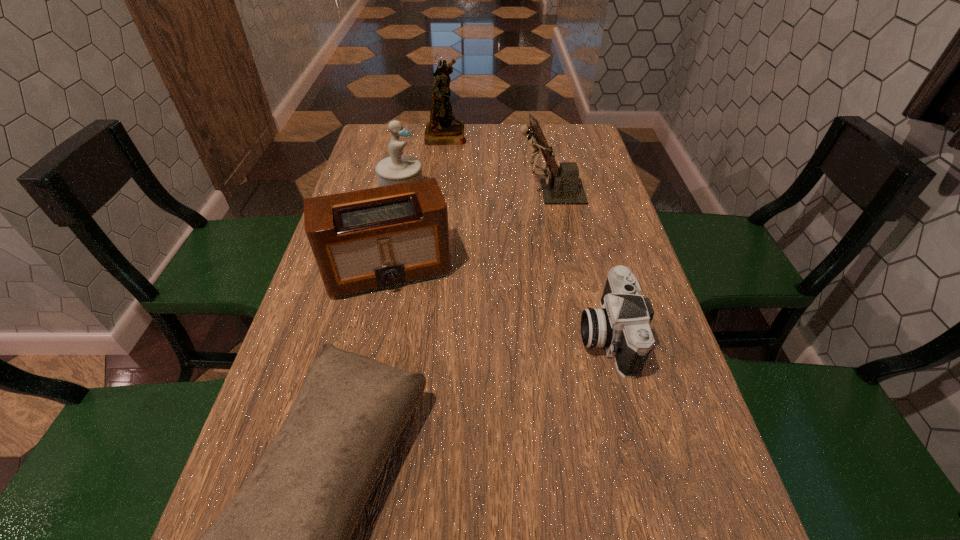
This screenshot has height=540, width=960. I want to click on object located at the far edge, so click(443, 129).

Locate an element on the screen. This screenshot has height=540, width=960. figurine at the left edge is located at coordinates (398, 168).

At what (x,y) coordinates should I click in order to perform the action: click on radio receiver at the left edge. Please return your answer as a coordinate pair (x, y). Looking at the image, I should click on (367, 240).

Where is `figurine at the right edge`? figurine at the right edge is located at coordinates [x=564, y=187].

Identify the location of camera that is at the right edge. (621, 325).

The image size is (960, 540). Find the location of `free region at the far edge`. free region at the far edge is located at coordinates (419, 150).

The height and width of the screenshot is (540, 960). In the image, there is a desktop. What are the coordinates of `vacant space at the left edge` in the screenshot? It's located at tap(368, 330).

In the image, there is a desktop. Where is `vacant region at the right edge`? This screenshot has width=960, height=540. vacant region at the right edge is located at coordinates (607, 255).

Locate an element on the screen. The image size is (960, 540). free space between the camera and the rightmost figurine is located at coordinates (579, 263).

You are a GUI agent. You are given a task and a screenshot of the screen. Output one action in this format:
    pyautogui.click(x=<x>, y=<y>)
    Task: Click on the free spot between the camera and the rightmost figurine
    The height and width of the screenshot is (540, 960).
    Given the screenshot: What is the action you would take?
    pyautogui.click(x=579, y=263)